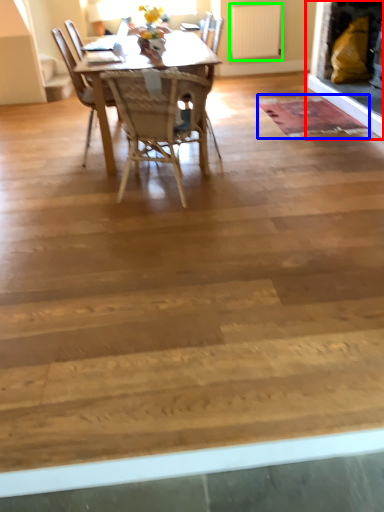
Question: Considering the real-world distances, which object is farthest from fireplace (highlighted by a red box)? mat (highlighted by a blue box) or radiator (highlighted by a green box)?

Choices:
 (A) mat
 (B) radiator

Answer: (B)